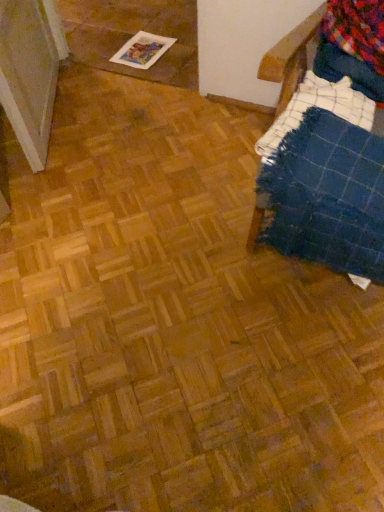
The width and height of the screenshot is (384, 512). Identify the location of vacant area situated below printed paper magazine at upper left (from a real-world perspective). (149, 51).